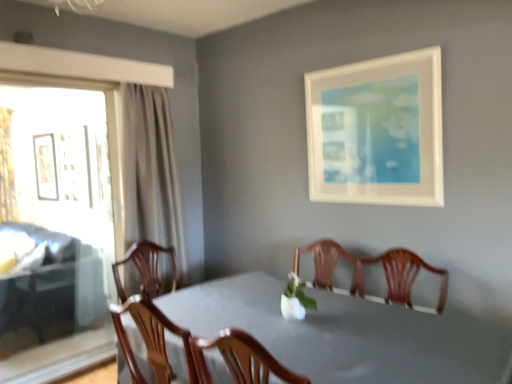
Question: From a real-world perspective, does matte black picture frame at left, which ranks as the second picture frame in right-to-left order, sit lower than white matte picture frame at upper right, acting as the 2th picture frame starting from the left?

Choices:
 (A) no
 (B) yes

Answer: (B)

Question: Is matte black picture frame at left, which appears as the 1th picture frame when viewed from the back, behind white matte picture frame at upper right, which ranks as the 1th picture frame in front-to-back order?

Choices:
 (A) yes
 (B) no

Answer: (A)

Question: Can you confirm if matte black picture frame at left, arranged as the 2th picture frame when viewed from the front, is wider than white matte picture frame at upper right, acting as the 2th picture frame starting from the left?

Choices:
 (A) no
 (B) yes

Answer: (B)

Question: Is matte black picture frame at left, which appears as the 1th picture frame when viewed from the back, bigger than white matte picture frame at upper right, the second picture frame viewed from the back?

Choices:
 (A) yes
 (B) no

Answer: (A)

Question: Is matte black picture frame at left, which ranks as the second picture frame in right-to-left order, aimed at white matte picture frame at upper right, acting as the 2th picture frame starting from the left?

Choices:
 (A) yes
 (B) no

Answer: (B)

Question: Can you confirm if matte black picture frame at left, which appears as the 1th picture frame when viewed from the back, is shorter than white matte picture frame at upper right, acting as the 2th picture frame starting from the left?

Choices:
 (A) yes
 (B) no

Answer: (A)

Question: Is the position of gold textured curtain at left less distant than that of white matte picture frame at upper right, which ranks as the 1th picture frame in front-to-back order?

Choices:
 (A) no
 (B) yes

Answer: (A)

Question: Can you confirm if gold textured curtain at left is smaller than white matte picture frame at upper right, which ranks as the 1th picture frame in front-to-back order?

Choices:
 (A) yes
 (B) no

Answer: (B)

Question: Is gold textured curtain at left located outside white matte picture frame at upper right, acting as the 2th picture frame starting from the left?

Choices:
 (A) yes
 (B) no

Answer: (A)

Question: Would you say white matte picture frame at upper right, the first picture frame from the right, is part of gold textured curtain at left's contents?

Choices:
 (A) yes
 (B) no

Answer: (B)

Question: From the image's perspective, would you say gold textured curtain at left is positioned over white matte picture frame at upper right, the second picture frame viewed from the back?

Choices:
 (A) yes
 (B) no

Answer: (B)

Question: Is gold textured curtain at left to the left of white matte picture frame at upper right, acting as the 2th picture frame starting from the left, from the viewer's perspective?

Choices:
 (A) no
 (B) yes

Answer: (B)

Question: From the image's perspective, would you say smooth gray table at center is shown under gold textured curtain at left?

Choices:
 (A) yes
 (B) no

Answer: (A)